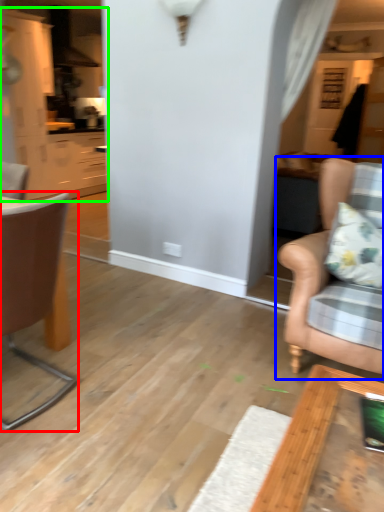
Question: Which object is positioned farthest from chair (highlighted by a red box)? Select from chair (highlighted by a blue box) and cabinetry (highlighted by a green box).

Choices:
 (A) chair
 (B) cabinetry

Answer: (B)